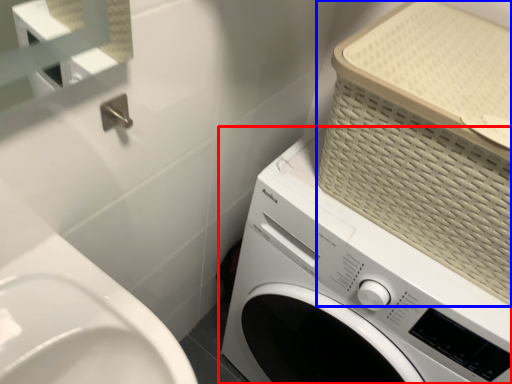
Question: Which object is closer to the camera taking this photo, washing machine (highlighted by a red box) or basket (highlighted by a blue box)?

Choices:
 (A) washing machine
 (B) basket

Answer: (B)